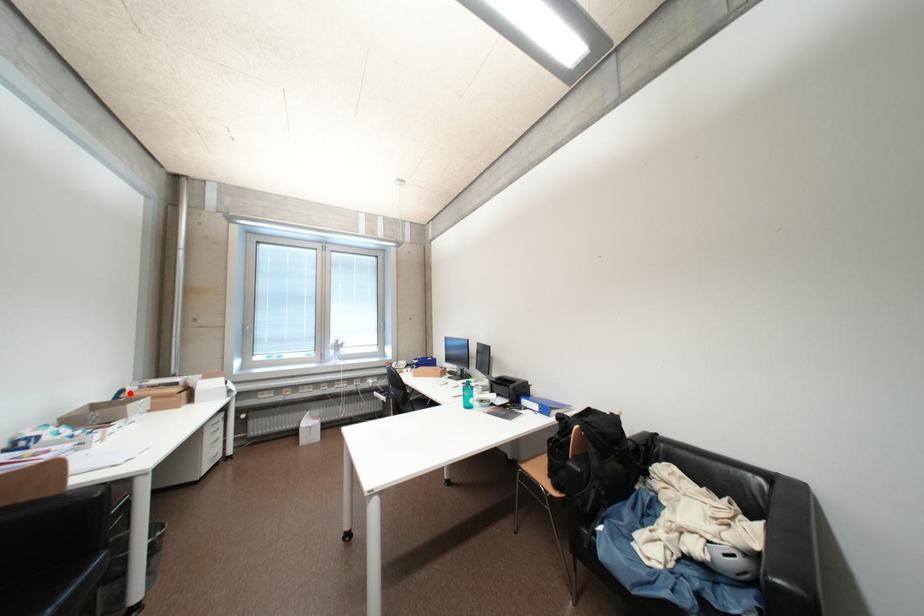
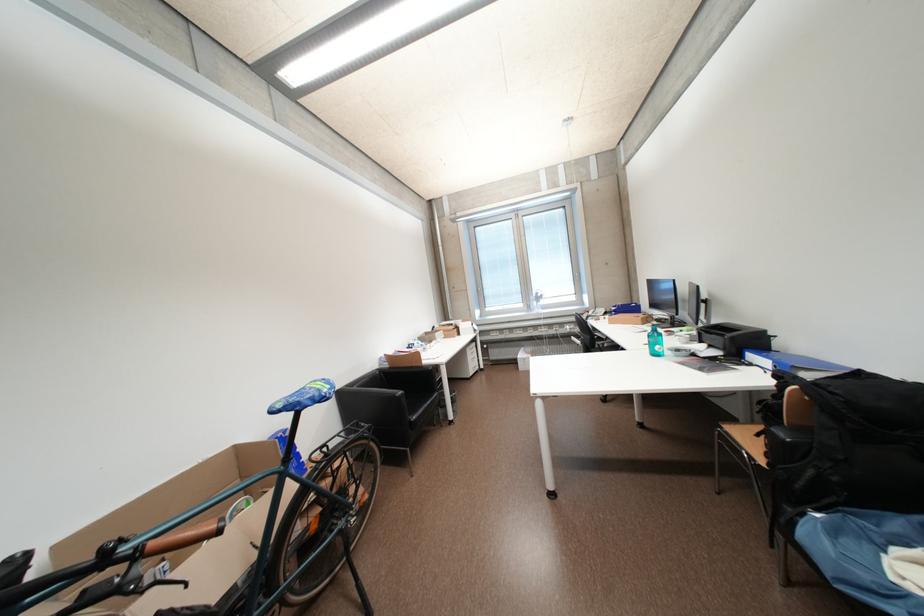
Locate, in the second image, the point that corresponds to the highlighted location in the first image.

(442, 330)